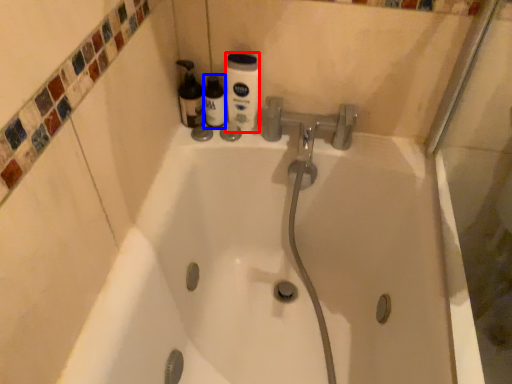
Question: Among these objects, which one is nearest to the camera, cleaning product (highlighted by a red box) or bottle (highlighted by a blue box)?

Choices:
 (A) cleaning product
 (B) bottle

Answer: (A)